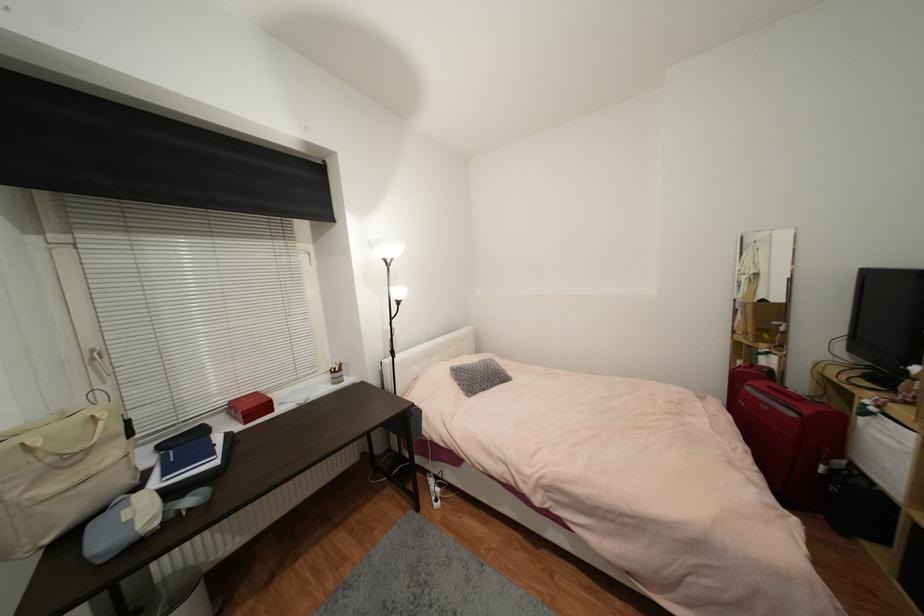
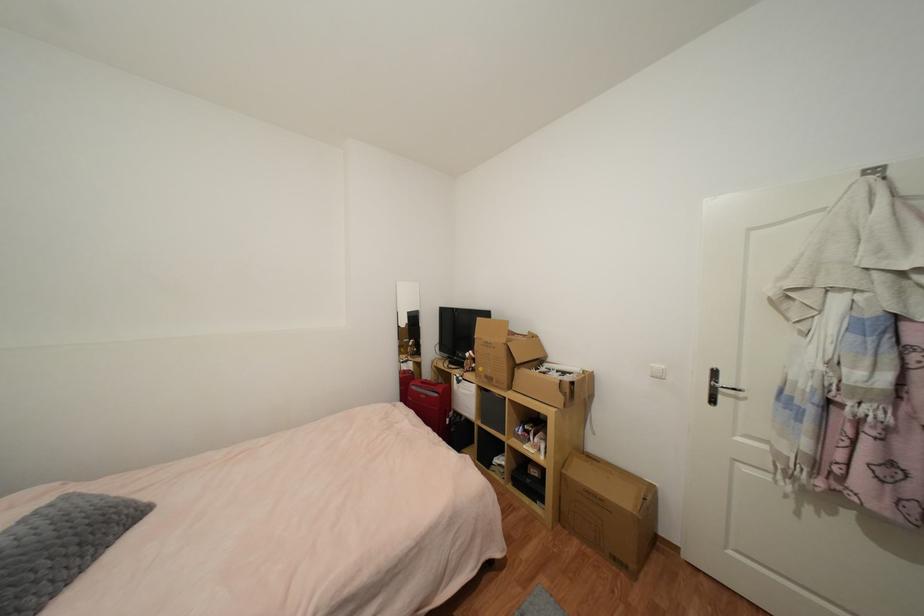
Locate, in the second image, the point that corresponds to point (491, 379) in the first image.

(79, 551)